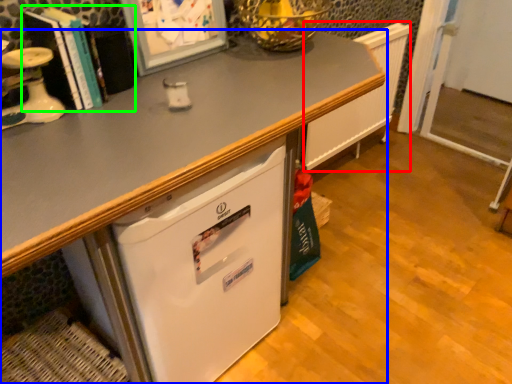
Question: Estimate the real-world distances between objects in this image. Which object is closer to radiator (highlighted by a red box), desk (highlighted by a blue box) or book (highlighted by a green box)?

Choices:
 (A) desk
 (B) book

Answer: (A)